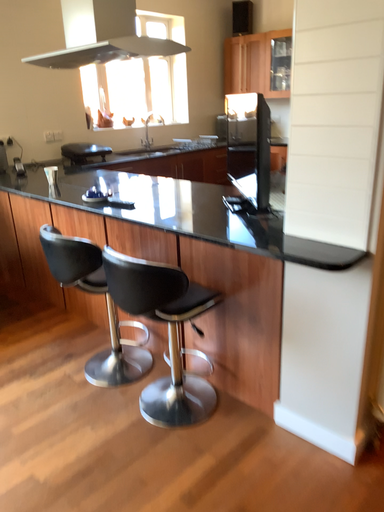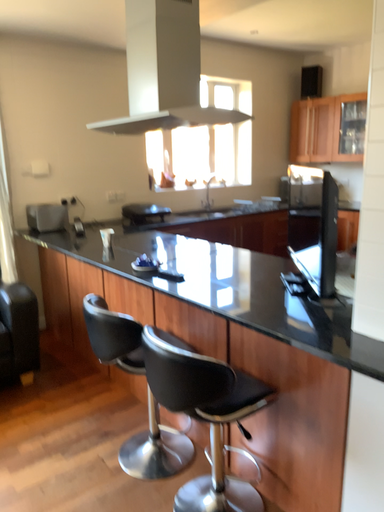
Question: Which way did the camera rotate in the video?

Choices:
 (A) rotated left
 (B) rotated right

Answer: (A)